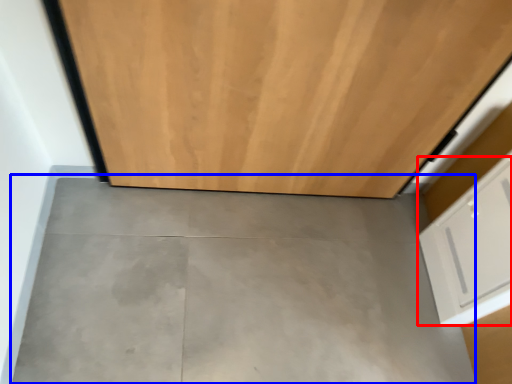
Question: Among these objects, which one is nearest to the camera, drawer (highlighted by a red box) or concrete (highlighted by a blue box)?

Choices:
 (A) drawer
 (B) concrete

Answer: (A)